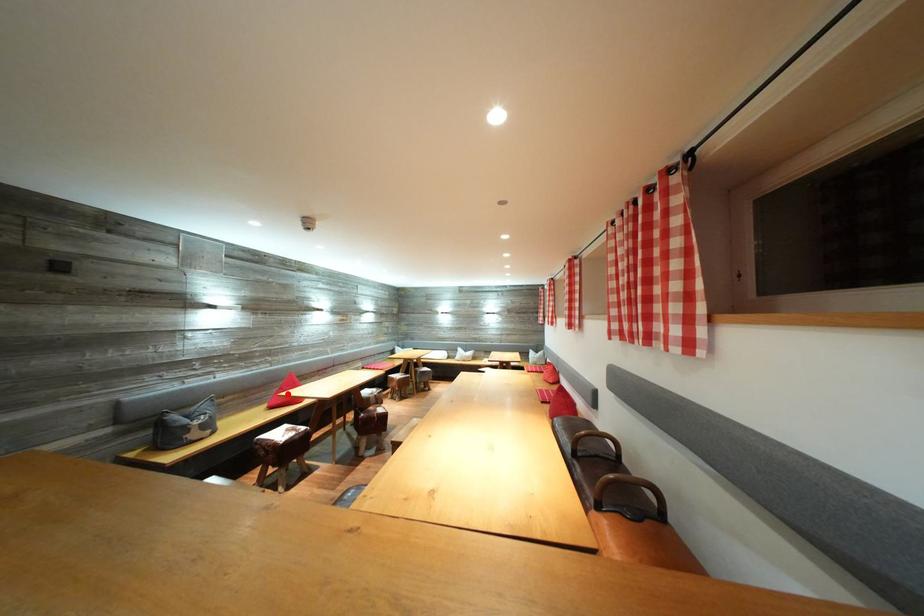
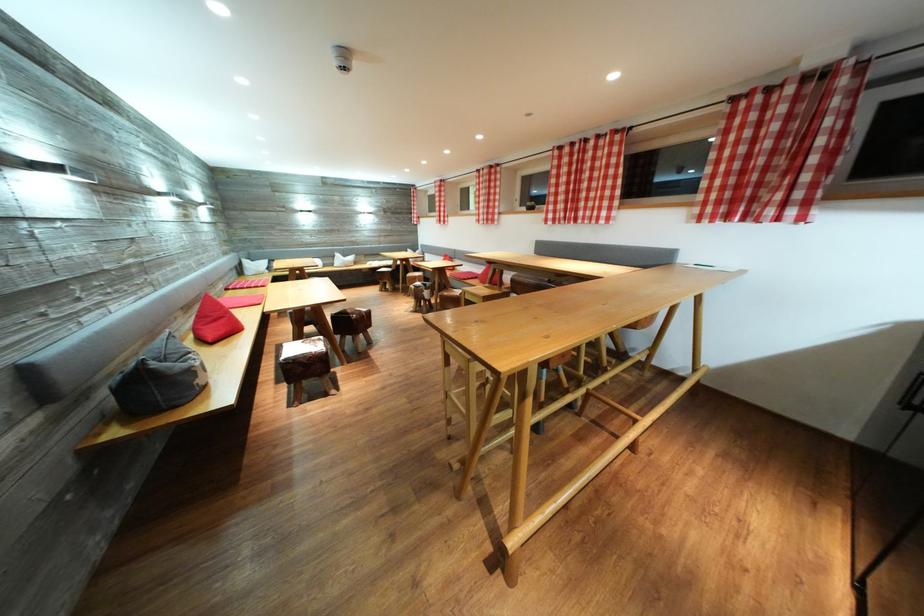
Question: I am providing you with two images of the same scene from different viewpoints. Image1 has a red point marked. In image2, the corresponding 3D location appears at what relative position? Reply with the corresponding letter.

Choices:
 (A) Closer
 (B) Farther

Answer: (A)